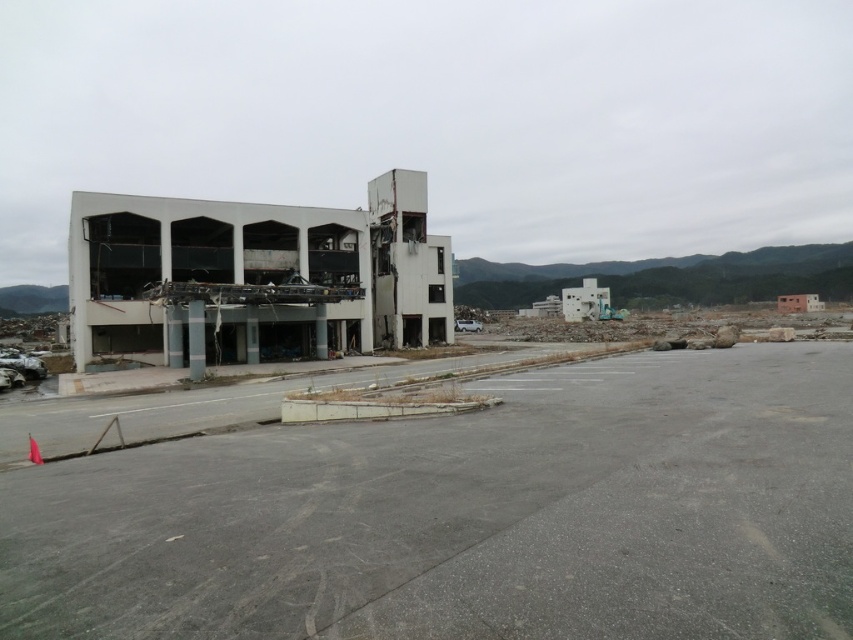
You are a surveyor assessing the structural integrity of the white concrete building at left and the white concrete building at center. Which building is located closer to the ground level?

The white concrete building at left is positioned under the white concrete building at center, so it is closer to the ground level.

You are standing in front of the white concrete building at left and the white concrete building at center. Which building is nearer to you?

The white concrete building at left is closer to the viewer than the white concrete building at center, so it is nearer to you.